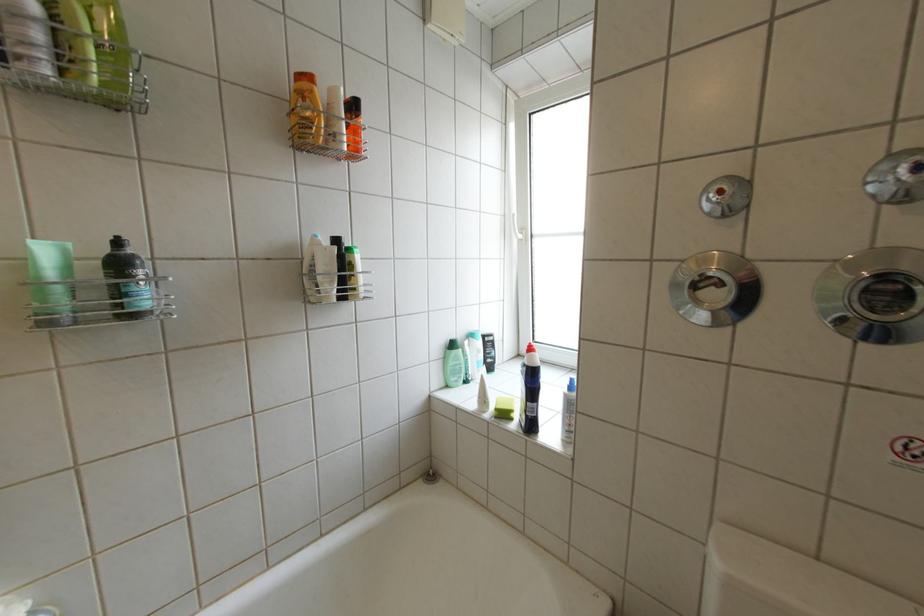
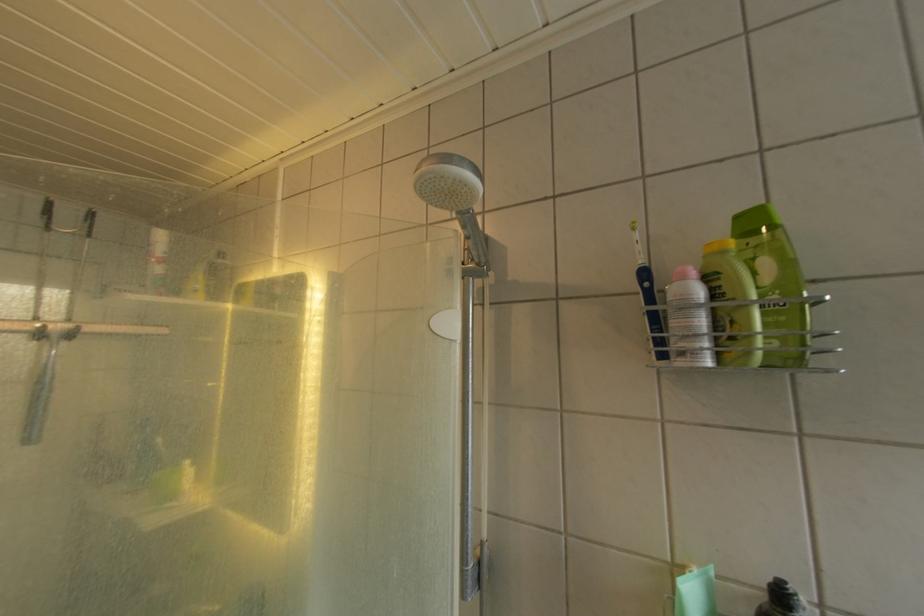
Question: The camera is either moving clockwise (left) or counter-clockwise (right) around the object. The first image is from the beginning of the video and the second image is from the end. Is the camera moving left or right when shooting the video?

Choices:
 (A) Left
 (B) Right

Answer: (B)